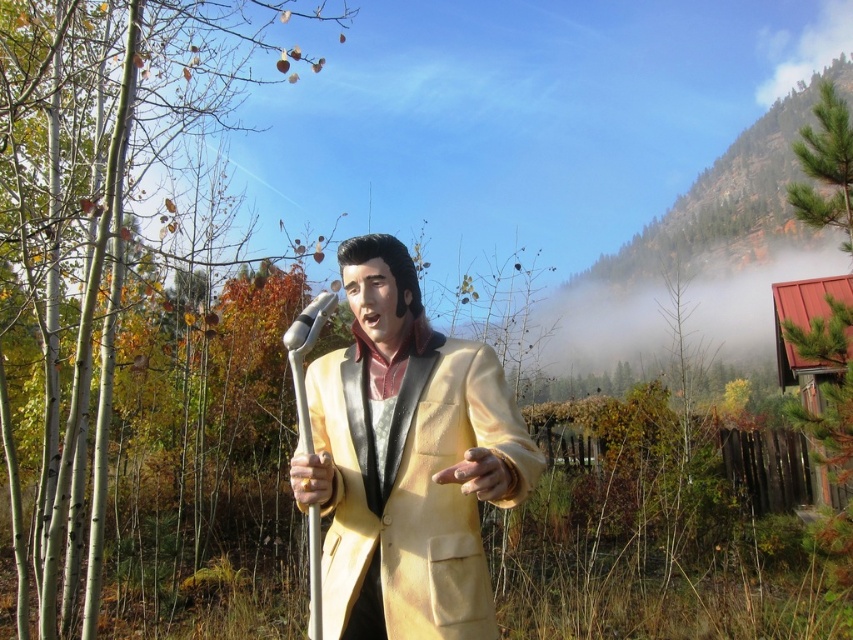
You are standing in front of the statue and want to determine the relative positions of two points marked on the statue. The first point is at coordinate point (497,460) and the second is at point (316,337). Which point is closer to you?

Point (497,460) is closer to the viewer than point (316,337).

You are a photographer setting up for a shoot with the statue. You need to ensure the matte gold suit at center and the silver metallic microphone at center are both in focus. Given that your camera can only focus on objects within a 1.2 meter height range, will both objects be in focus?

The matte gold suit at center is taller than the silver metallic microphone at center. Since the camera can focus on objects within a 1.2 meter height range, both objects will be in focus as long as their height difference is within that range. However, the exact focus depends on their actual heights, which are not provided here.

You are an artist trying to sketch the scene. You need to place the matte gold suit at center in your drawing. What are the coordinates where you should position it?

The coordinates for the matte gold suit at center are at point [407,460].